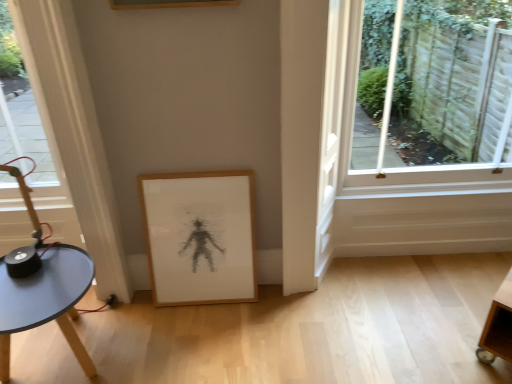
Locate an element on the screen. Image resolution: width=512 pixels, height=384 pixels. blank space situated above matte blue table at lower left (from a real-world perspective) is located at coordinates (45, 280).